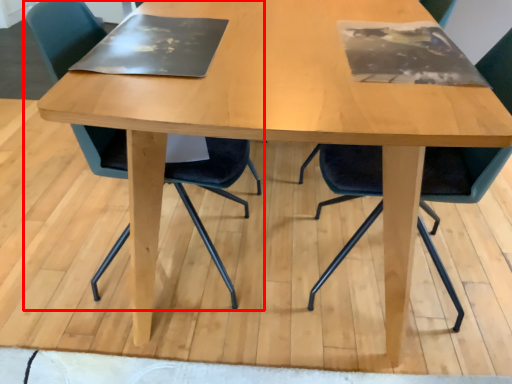
Question: From the image's perspective, considering the relative positions of chair (annotated by the red box) and chair in the image provided, where is chair (annotated by the red box) located with respect to the staircase?

Choices:
 (A) below
 (B) above

Answer: (B)